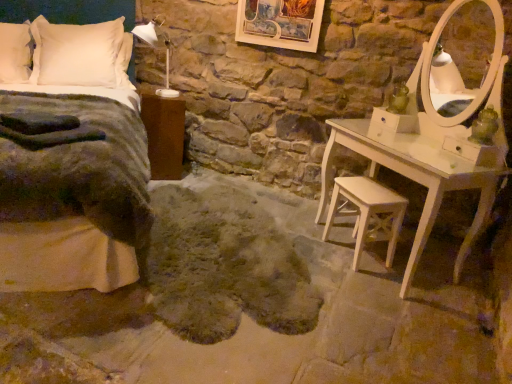
Where is `space that is in front of white wood stool at lower right`? space that is in front of white wood stool at lower right is located at coordinates (364, 285).